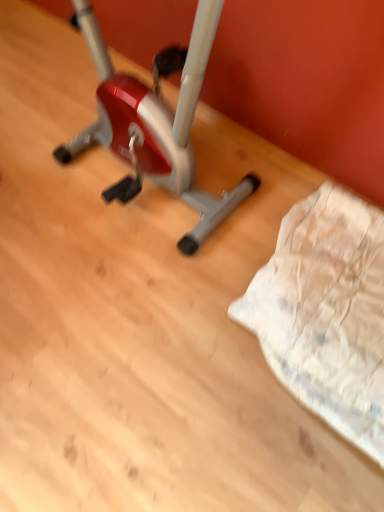
Locate an element on the screen. white textured fabric at lower right is located at coordinates (326, 312).

What do you see at coordinates (326, 312) in the screenshot? The height and width of the screenshot is (512, 384). I see `white textured fabric at lower right` at bounding box center [326, 312].

From the picture: Measure the distance between metallic silver stationary bicycle at center and camera.

33.27 inches.

What do you see at coordinates (156, 122) in the screenshot? The image size is (384, 512). I see `metallic silver stationary bicycle at center` at bounding box center [156, 122].

In order to click on metallic silver stationary bicycle at center in this screenshot , I will do `click(156, 122)`.

Where is `white textured fabric at lower right`? This screenshot has width=384, height=512. white textured fabric at lower right is located at coordinates (326, 312).

Considering the relative positions of metallic silver stationary bicycle at center and white textured fabric at lower right in the image provided, is metallic silver stationary bicycle at center to the right of white textured fabric at lower right from the viewer's perspective?

No, metallic silver stationary bicycle at center is not to the right of white textured fabric at lower right.

Which object is further away from the camera taking this photo, metallic silver stationary bicycle at center or white textured fabric at lower right?

white textured fabric at lower right.

Which is in front, point (250, 174) or point (338, 211)?

Positioned in front is point (338, 211).

From the image's perspective, which object appears higher, metallic silver stationary bicycle at center or white textured fabric at lower right?

metallic silver stationary bicycle at center.

From a real-world perspective, is metallic silver stationary bicycle at center on top of white textured fabric at lower right?

Indeed, from a real-world perspective, metallic silver stationary bicycle at center stands above white textured fabric at lower right.

Does metallic silver stationary bicycle at center have a lesser width compared to white textured fabric at lower right?

Yes.

Who is shorter, metallic silver stationary bicycle at center or white textured fabric at lower right?

white textured fabric at lower right.

Based on the photo, is metallic silver stationary bicycle at center smaller than white textured fabric at lower right?

No.

Do you think metallic silver stationary bicycle at center is within white textured fabric at lower right, or outside of it?

metallic silver stationary bicycle at center is spatially situated outside white textured fabric at lower right.

Is metallic silver stationary bicycle at center not close to white textured fabric at lower right?

No.

Is metallic silver stationary bicycle at center oriented away from white textured fabric at lower right?

No.

Can you tell me how much metallic silver stationary bicycle at center and white textured fabric at lower right differ in facing direction?

The angle between the facing direction of metallic silver stationary bicycle at center and the facing direction of white textured fabric at lower right is 4.9e-05 degrees.

Measure the distance from metallic silver stationary bicycle at center to white textured fabric at lower right.

metallic silver stationary bicycle at center is 45.12 centimeters from white textured fabric at lower right.

Where is `sheet located on the right of metallic silver stationary bicycle at center`? Image resolution: width=384 pixels, height=512 pixels. sheet located on the right of metallic silver stationary bicycle at center is located at coordinates (326, 312).

From the picture: Which is more to the right, white textured fabric at lower right or metallic silver stationary bicycle at center?

Positioned to the right is white textured fabric at lower right.

Between white textured fabric at lower right and metallic silver stationary bicycle at center, which one is positioned in front?

metallic silver stationary bicycle at center is more forward.

Which is closer, (277, 350) or (105, 51)?

Point (277, 350) appears to be closer to the viewer than point (105, 51).

From the image's perspective, which is above, white textured fabric at lower right or metallic silver stationary bicycle at center?

metallic silver stationary bicycle at center.

From a real-world perspective, is white textured fabric at lower right over metallic silver stationary bicycle at center?

Incorrect, from a real-world perspective, white textured fabric at lower right is lower than metallic silver stationary bicycle at center.

Can you confirm if white textured fabric at lower right is wider than metallic silver stationary bicycle at center?

Indeed, white textured fabric at lower right has a greater width compared to metallic silver stationary bicycle at center.

Considering the sizes of white textured fabric at lower right and metallic silver stationary bicycle at center in the image, is white textured fabric at lower right taller or shorter than metallic silver stationary bicycle at center?

Considering their sizes, white textured fabric at lower right has less height than metallic silver stationary bicycle at center.

Considering the sizes of white textured fabric at lower right and metallic silver stationary bicycle at center in the image, is white textured fabric at lower right bigger or smaller than metallic silver stationary bicycle at center?

Clearly, white textured fabric at lower right is smaller in size than metallic silver stationary bicycle at center.

Is metallic silver stationary bicycle at center surrounded by white textured fabric at lower right?

No, metallic silver stationary bicycle at center is not surrounded by white textured fabric at lower right.

Is white textured fabric at lower right far from metallic silver stationary bicycle at center?

No, white textured fabric at lower right is not far away from metallic silver stationary bicycle at center.

Consider the image. Is white textured fabric at lower right turned away from metallic silver stationary bicycle at center?

white textured fabric at lower right does not have its back to metallic silver stationary bicycle at center.

Where is `sheet below the metallic silver stationary bicycle at center (from the image's perspective)`? Image resolution: width=384 pixels, height=512 pixels. sheet below the metallic silver stationary bicycle at center (from the image's perspective) is located at coordinates (326, 312).

The width and height of the screenshot is (384, 512). I want to click on stationary bicycle lying on the left of white textured fabric at lower right, so click(156, 122).

The image size is (384, 512). In order to click on stationary bicycle above the white textured fabric at lower right (from the image's perspective) in this screenshot , I will do `click(156, 122)`.